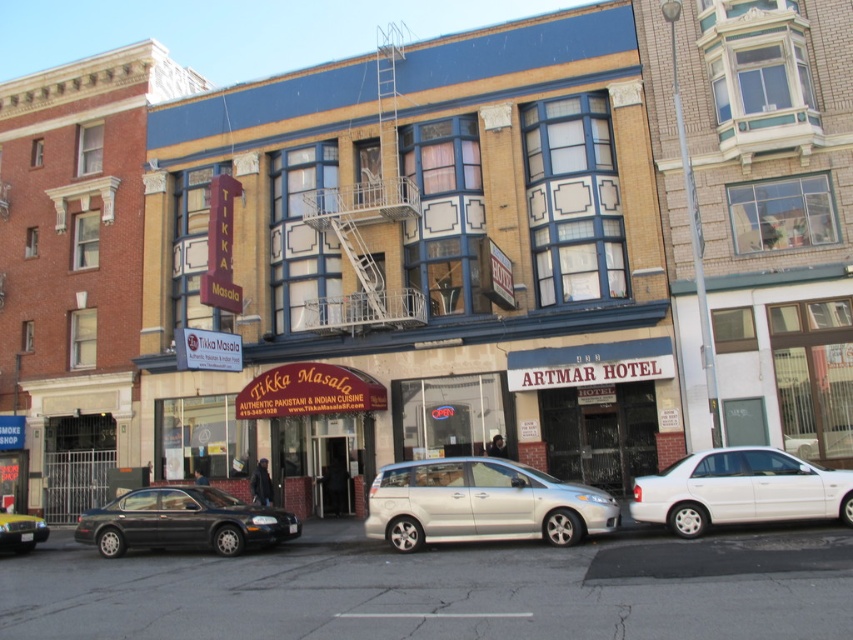
Between silver metallic minivan at center and shiny black sedan at lower left, which one is positioned higher?

Positioned higher is silver metallic minivan at center.

Who is positioned more to the left, silver metallic minivan at center or shiny black sedan at lower left?

shiny black sedan at lower left is more to the left.

Is point (413, 529) in front of point (241, 536)?

That is True.

At what (x,y) coordinates should I click in order to perform the action: click on silver metallic minivan at center. Please return your answer as a coordinate pair (x, y). The image size is (853, 640). Looking at the image, I should click on (480, 502).

Between shiny black sedan at lower left and black glossy sedan at lower left, which one appears on the right side from the viewer's perspective?

shiny black sedan at lower left

Is point (187, 518) closer to viewer compared to point (15, 536)?

Yes, point (187, 518) is in front of point (15, 536).

Is point (192, 524) more distant than point (0, 531)?

No, (192, 524) is closer to viewer.

The width and height of the screenshot is (853, 640). Identify the location of shiny black sedan at lower left. (183, 522).

Does point (379, 275) lie in front of point (726, 502)?

That is False.

Describe the element at coordinates (422, 259) in the screenshot. I see `maroon fabric signboard at center` at that location.

Where is `maroon fabric signboard at center`? maroon fabric signboard at center is located at coordinates (422, 259).